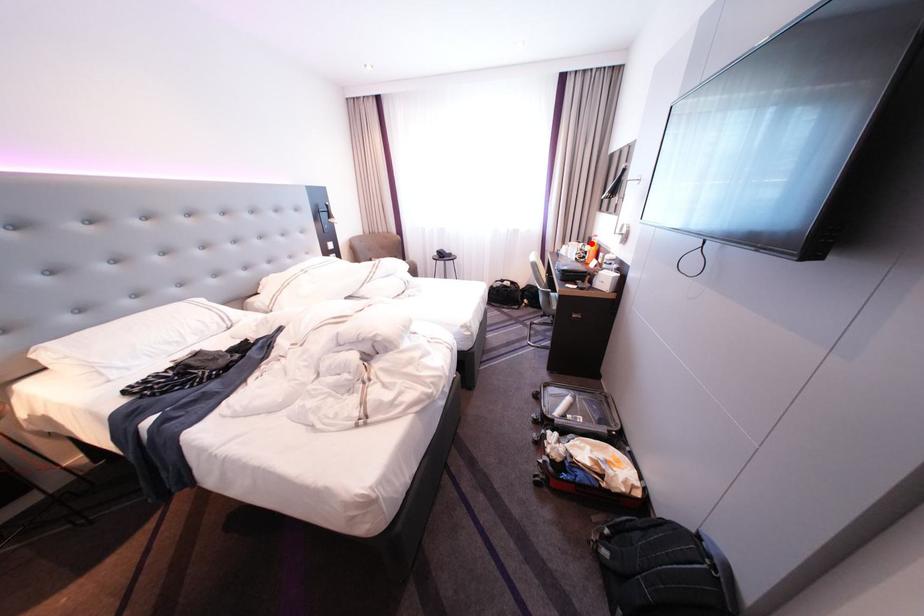
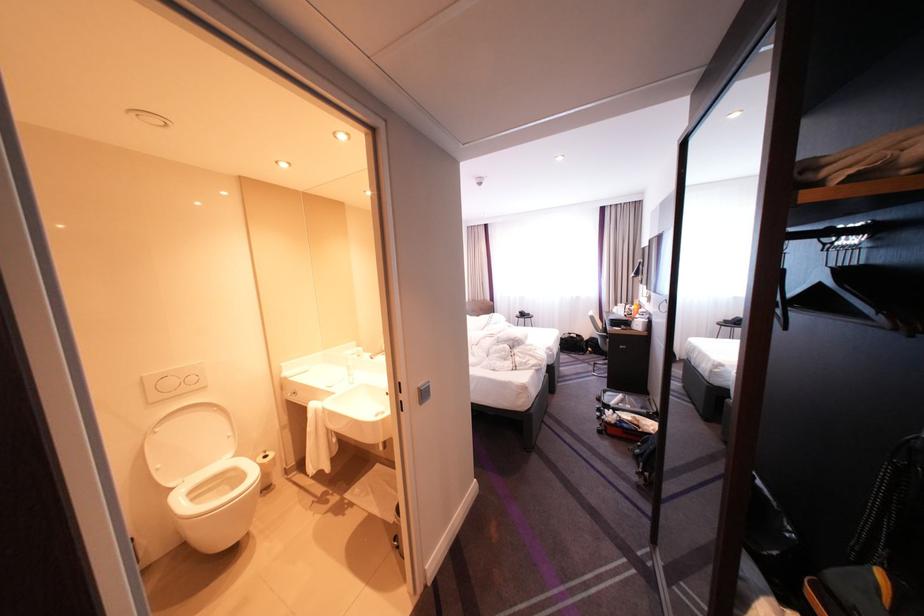
Find the pixel in the second image that matches the highlighted location in the first image.

(638, 305)